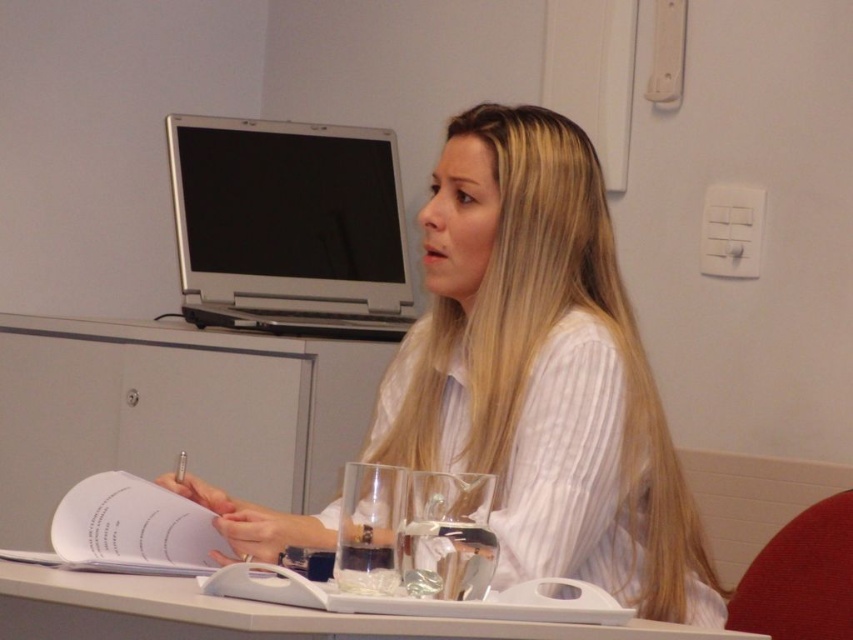
The width and height of the screenshot is (853, 640). What do you see at coordinates (288, 227) in the screenshot?
I see `silver metallic laptop at upper center` at bounding box center [288, 227].

Locate an element on the screen. The width and height of the screenshot is (853, 640). silver metallic laptop at upper center is located at coordinates (288, 227).

Where is `silver metallic laptop at upper center`? This screenshot has width=853, height=640. silver metallic laptop at upper center is located at coordinates (288, 227).

Does white striped shirt at center have a lesser height compared to clear glass wine glass at center?

Incorrect, white striped shirt at center's height does not fall short of clear glass wine glass at center's.

Does point (502, 401) lie in front of point (415, 586)?

That is False.

Find the location of a particular element. The height and width of the screenshot is (640, 853). white striped shirt at center is located at coordinates (543, 371).

Where is `white striped shirt at center`? Image resolution: width=853 pixels, height=640 pixels. white striped shirt at center is located at coordinates (543, 371).

Describe the element at coordinates (271, 611) in the screenshot. I see `white plastic tray at center` at that location.

Is white plastic tray at center to the left of clear glass wine glass at center from the viewer's perspective?

Indeed, white plastic tray at center is positioned on the left side of clear glass wine glass at center.

Which is in front, point (531, 621) or point (461, 504)?

Point (531, 621)

I want to click on white plastic tray at center, so click(271, 611).